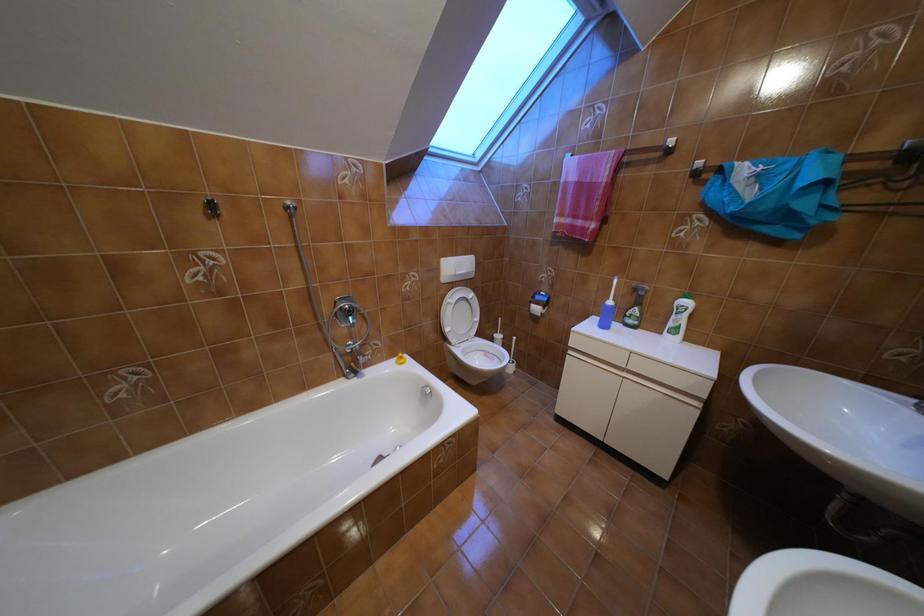
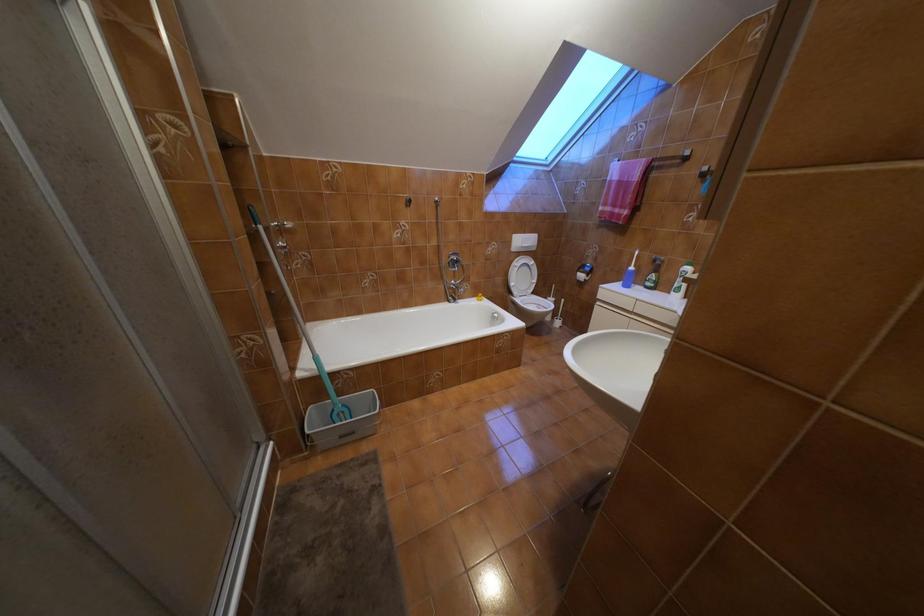
Question: Which direction would the cameraman need to move to produce the second image? Reply with the corresponding letter.

Choices:
 (A) Left
 (B) Right
 (C) Forward
 (D) Backward

Answer: (D)